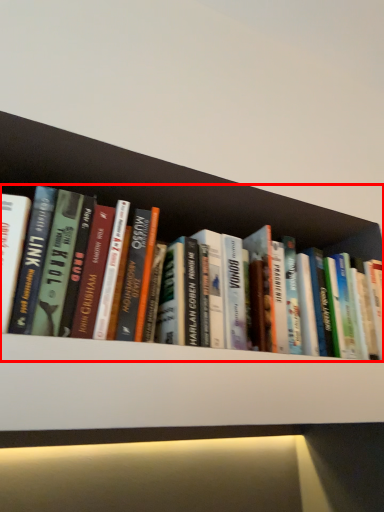
Question: From the image's perspective, considering the relative positions of book (annotated by the red box) and shelf in the image provided, where is book (annotated by the red box) located with respect to the staircase?

Choices:
 (A) above
 (B) below

Answer: (A)